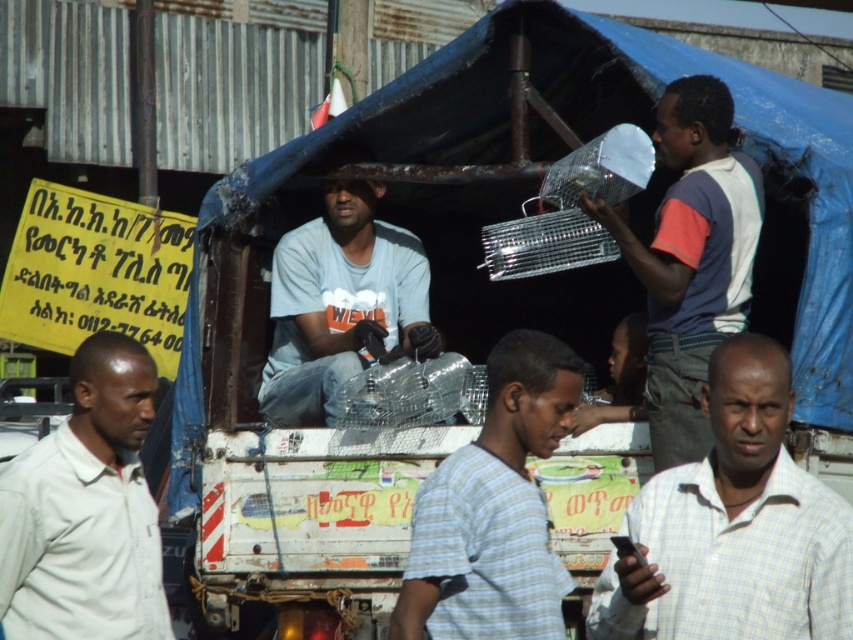
You are a photographer standing in the street scene. You want to take a photo of the light blue striped shirt at center and the white plastic bag at upper right. How far apart are these two objects in the image?

The light blue striped shirt at center is 33.22 inches from the white plastic bag at upper right.

You are a pedestrian standing in the street scene described. You notice a light blue striped shirt at center and a white plastic bag at upper right. Which object is positioned higher in the image?

The white plastic bag at upper right is positioned higher than the light blue striped shirt at center.